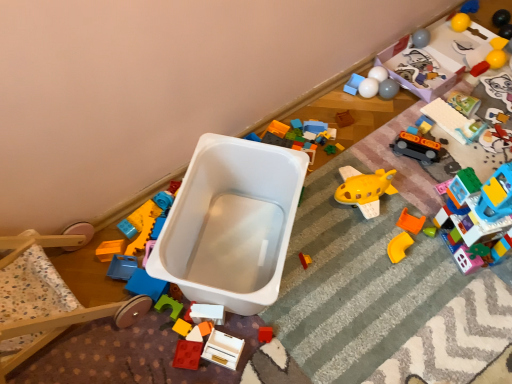
The height and width of the screenshot is (384, 512). I want to click on free space to the back side of white glossy balls at upper right, the ninth toy positioned from the left, so click(x=372, y=68).